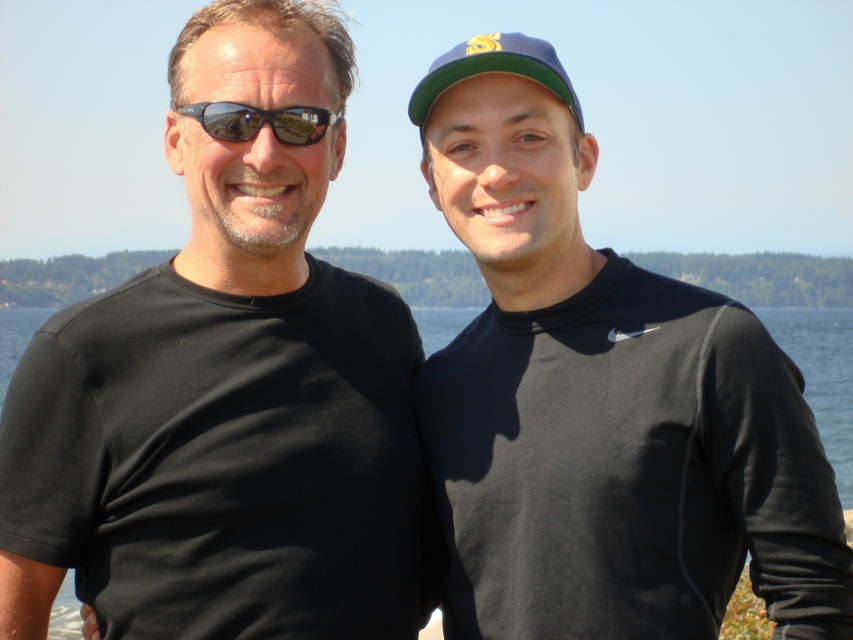
Question: Does transparent water at center have a smaller size compared to matte black goggles at left?

Choices:
 (A) no
 (B) yes

Answer: (A)

Question: Which is farther from the matte black goggles at left?

Choices:
 (A) green fabric baseball cap at upper center
 (B) transparent water at center
 (C) matte black t-shirt at left
 (D) black matte shirt at right

Answer: (B)

Question: Which is farther from the green fabric baseball cap at upper center?

Choices:
 (A) transparent water at center
 (B) matte black t-shirt at left
 (C) matte black goggles at left
 (D) black matte shirt at right

Answer: (A)

Question: Considering the real-world distances, which object is farthest from the transparent water at center?

Choices:
 (A) black matte shirt at right
 (B) green fabric baseball cap at upper center
 (C) matte black goggles at left
 (D) matte black t-shirt at left

Answer: (B)

Question: Can you confirm if black matte shirt at right is positioned to the left of green fabric baseball cap at upper center?

Choices:
 (A) no
 (B) yes

Answer: (B)

Question: Does matte black t-shirt at left have a greater width compared to green fabric baseball cap at upper center?

Choices:
 (A) no
 (B) yes

Answer: (B)